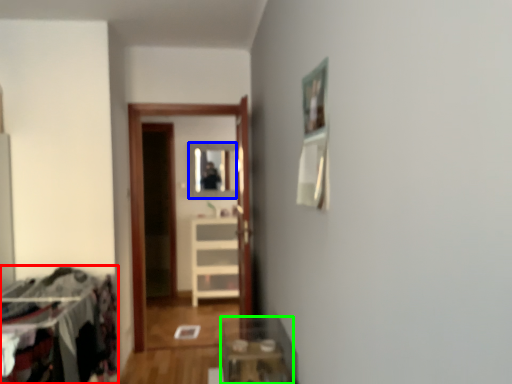
Question: Which is nearer to the laundry (highlighted by a red box)? mirror (highlighted by a blue box) or table (highlighted by a green box).

Choices:
 (A) mirror
 (B) table

Answer: (B)